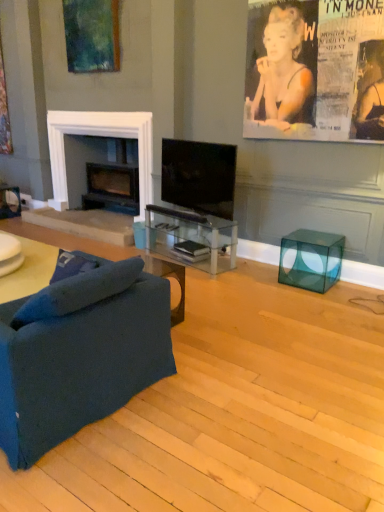
Question: From the image's perspective, is matte black magazine at center, the 1th magazine from the bottom, positioned above or below black matte fireplace at left?

Choices:
 (A) above
 (B) below

Answer: (B)

Question: From a real-world perspective, is matte black magazine at center, marked as the 2th magazine in a top-to-bottom arrangement, physically located above or below black matte fireplace at left?

Choices:
 (A) below
 (B) above

Answer: (A)

Question: Which of these objects is positioned farthest from the matte black book at center, marked as the 1th magazine in a top-to-bottom arrangement?

Choices:
 (A) black glossy tv at center
 (B) black matte fireplace at left
 (C) matte paper poster at upper right
 (D) transparent glass tv stand at center
 (E) transparent glass cube at lower right

Answer: (C)

Question: Which object is the closest to the black matte fireplace at left?

Choices:
 (A) transparent glass tv stand at center
 (B) matte paper poster at upper right
 (C) velvet blue studio couch at lower left
 (D) matte black magazine at center, the 1th magazine from the bottom
 (E) black glossy tv at center

Answer: (E)